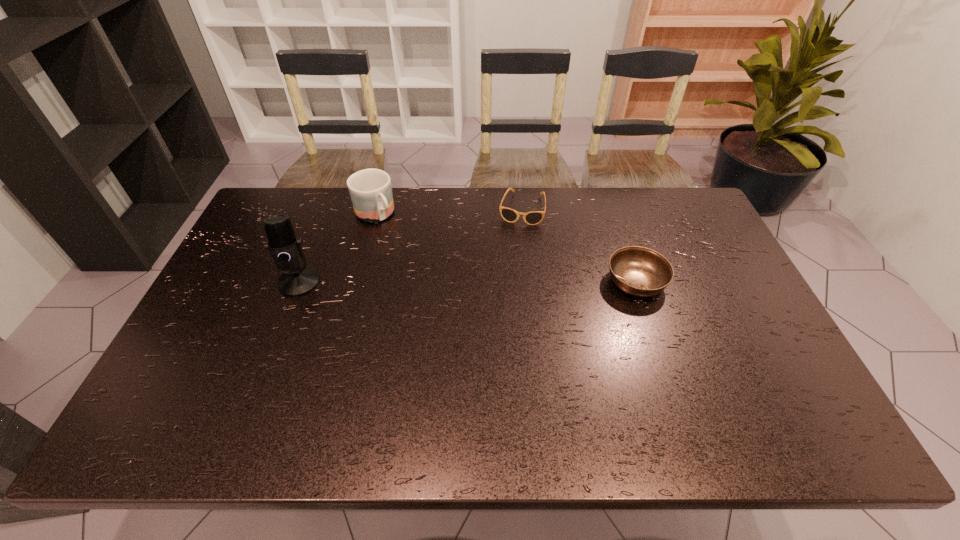
This screenshot has height=540, width=960. Find the location of `the third closest object relative to the soup bowl`. the third closest object relative to the soup bowl is located at coordinates (285, 248).

You are a GUI agent. You are given a task and a screenshot of the screen. Output one action in this format:
    pyautogui.click(x=<x>, y=<y>)
    Task: Click on the object that is the second nearest to the mug
    This screenshot has width=960, height=540.
    Given the screenshot: What is the action you would take?
    pyautogui.click(x=510, y=215)

Where is `free point that satisfies the following two spatial constraints: 1. on the front side of the second tallest object; 2. on the left side of the rightmost object`? The width and height of the screenshot is (960, 540). free point that satisfies the following two spatial constraints: 1. on the front side of the second tallest object; 2. on the left side of the rightmost object is located at coordinates (357, 281).